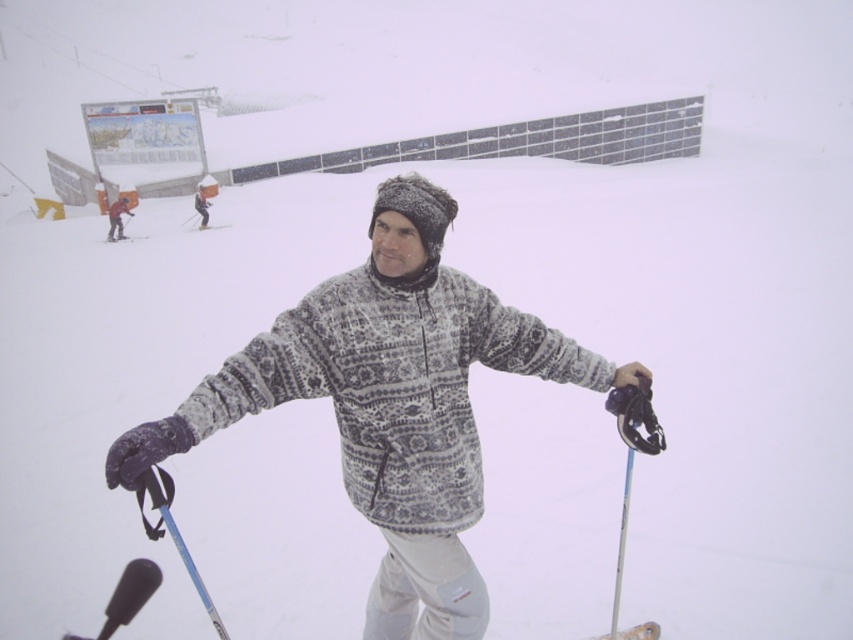
Which is more to the left, patterned fleece jacket at center or white plastic ski at upper center?

white plastic ski at upper center

Is point (424, 412) in front of point (190, 230)?

Yes, point (424, 412) is in front of point (190, 230).

The height and width of the screenshot is (640, 853). What are the coordinates of `patterned fleece jacket at center` in the screenshot? It's located at (390, 403).

Can you confirm if orange fabric jacket at upper left is positioned below white snowsuit at upper left?

Yes.

Where is `orange fabric jacket at upper left`? Image resolution: width=853 pixels, height=640 pixels. orange fabric jacket at upper left is located at coordinates (117, 218).

The image size is (853, 640). What do you see at coordinates (117, 218) in the screenshot?
I see `orange fabric jacket at upper left` at bounding box center [117, 218].

Locate an element on the screen. This screenshot has width=853, height=640. orange fabric jacket at upper left is located at coordinates (117, 218).

Does patterned fleece jacket at center have a lesser width compared to orange fabric jacket at upper left?

No, patterned fleece jacket at center is not thinner than orange fabric jacket at upper left.

Who is higher up, patterned fleece jacket at center or orange fabric jacket at upper left?

orange fabric jacket at upper left is above.

The image size is (853, 640). Find the location of `patterned fleece jacket at center`. patterned fleece jacket at center is located at coordinates (390, 403).

Where is `patterned fleece jacket at center`? This screenshot has width=853, height=640. patterned fleece jacket at center is located at coordinates (390, 403).